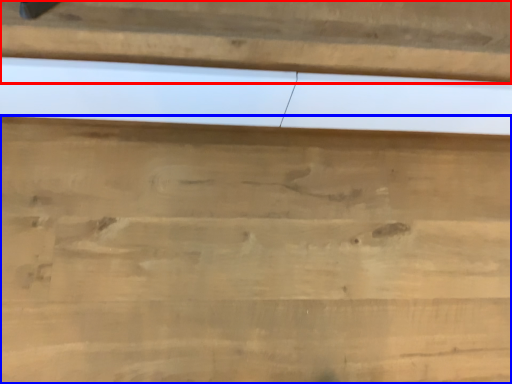
Question: Which object is further to the camera taking this photo, panel (highlighted by a red box) or cutting board (highlighted by a blue box)?

Choices:
 (A) panel
 (B) cutting board

Answer: (B)